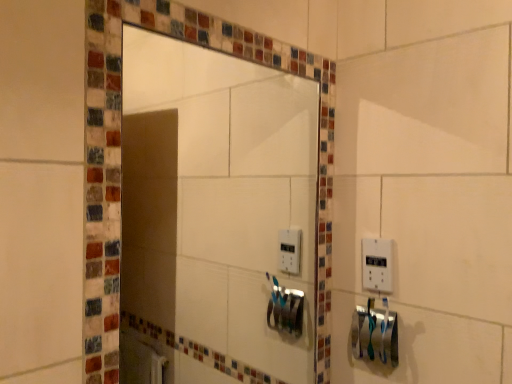
Question: Should I look upward or downward to see matte glass mirror at center?

Choices:
 (A) down
 (B) up

Answer: (A)

Question: Is matte glass mirror at center wider than silver metallic towel bar at lower right?

Choices:
 (A) yes
 (B) no

Answer: (B)

Question: From a real-world perspective, is matte glass mirror at center located higher than silver metallic towel bar at lower right?

Choices:
 (A) yes
 (B) no

Answer: (A)

Question: Is matte glass mirror at center facing away from silver metallic towel bar at lower right?

Choices:
 (A) yes
 (B) no

Answer: (B)

Question: Is matte glass mirror at center taller than silver metallic towel bar at lower right?

Choices:
 (A) no
 (B) yes

Answer: (B)

Question: Is matte glass mirror at center to the left of silver metallic towel bar at lower right from the viewer's perspective?

Choices:
 (A) no
 (B) yes

Answer: (B)

Question: Considering the relative sizes of matte glass mirror at center and silver metallic towel bar at lower right in the image provided, is matte glass mirror at center smaller than silver metallic towel bar at lower right?

Choices:
 (A) yes
 (B) no

Answer: (B)

Question: From a real-world perspective, is silver metallic towel bar at lower right physically above white plastic light switch at right?

Choices:
 (A) yes
 (B) no

Answer: (B)

Question: Could you tell me if silver metallic towel bar at lower right is facing white plastic light switch at right?

Choices:
 (A) yes
 (B) no

Answer: (B)

Question: Can we say silver metallic towel bar at lower right lies outside white plastic light switch at right?

Choices:
 (A) yes
 (B) no

Answer: (A)

Question: Considering the relative sizes of silver metallic towel bar at lower right and white plastic light switch at right in the image provided, is silver metallic towel bar at lower right taller than white plastic light switch at right?

Choices:
 (A) no
 (B) yes

Answer: (A)

Question: From the image's perspective, is silver metallic towel bar at lower right beneath white plastic light switch at right?

Choices:
 (A) no
 (B) yes

Answer: (B)

Question: Does silver metallic towel bar at lower right have a lesser width compared to white plastic light switch at right?

Choices:
 (A) no
 (B) yes

Answer: (A)

Question: Is silver metallic towel bar at lower right at the left side of matte glass mirror at center?

Choices:
 (A) yes
 (B) no

Answer: (B)